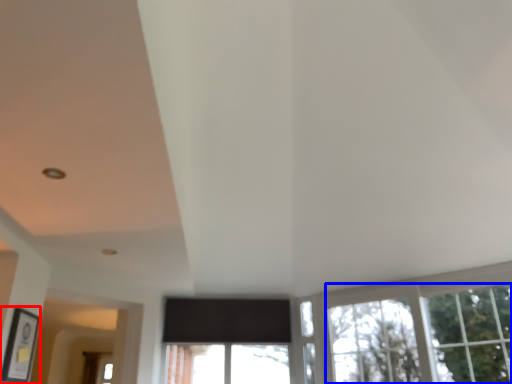
Question: Which of the following is the farthest to the observer, picture frame (highlighted by a red box) or tree (highlighted by a blue box)?

Choices:
 (A) picture frame
 (B) tree

Answer: (B)